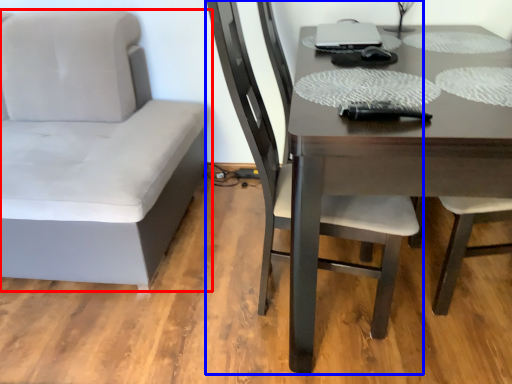
Question: Among these objects, which one is nearest to the camera, chair (highlighted by a red box) or chair (highlighted by a blue box)?

Choices:
 (A) chair
 (B) chair

Answer: (B)